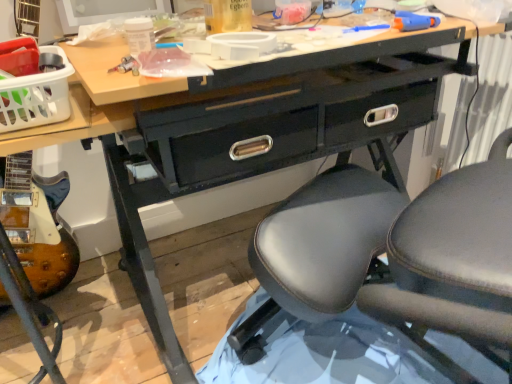
Where is `free point below wooden electric guitar at lower left (from a real-world perspective)`? This screenshot has width=512, height=384. free point below wooden electric guitar at lower left (from a real-world perspective) is located at coordinates (29, 358).